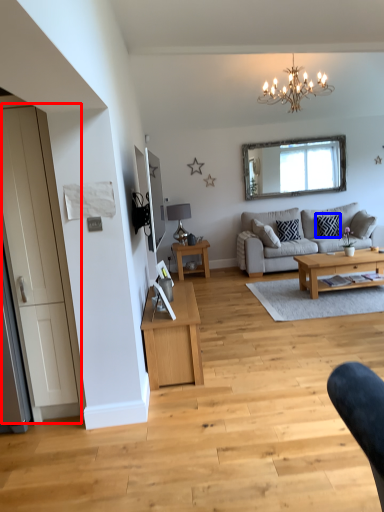
Question: Which point is closer to the camera, door (highlighted by a red box) or pillow (highlighted by a blue box)?

Choices:
 (A) door
 (B) pillow

Answer: (A)